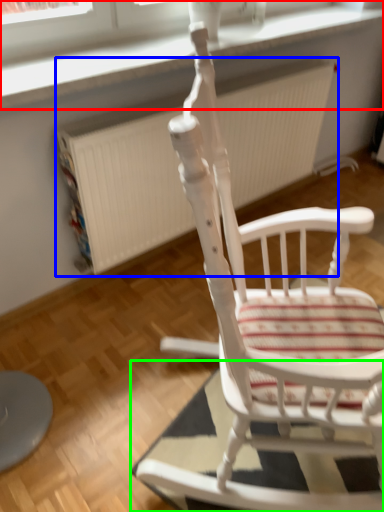
Question: Which object is the closest to the window frame (highlighted by a red box)? Choose among these: radiator (highlighted by a blue box) or mat (highlighted by a green box).

Choices:
 (A) radiator
 (B) mat

Answer: (A)